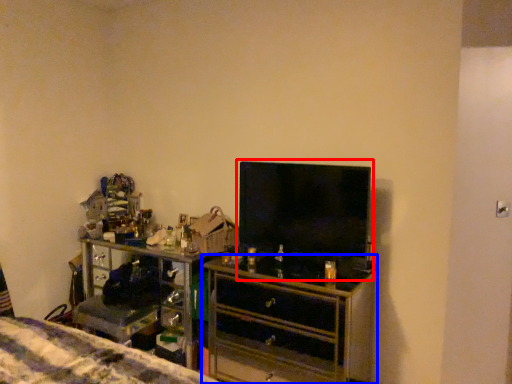
Question: Which object is further to the camera taking this photo, tv show (highlighted by a red box) or chest of drawers (highlighted by a blue box)?

Choices:
 (A) tv show
 (B) chest of drawers

Answer: (A)